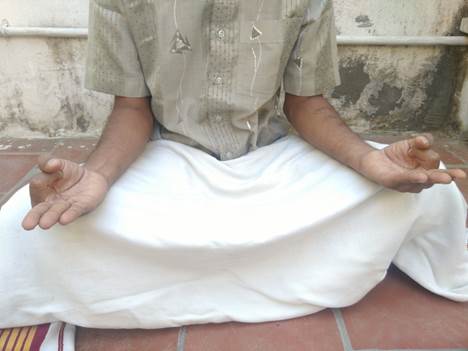
At what (x,y) coordinates should I click in order to perform the action: click on white sheet. Please return your answer as a coordinate pair (x, y). Looking at the image, I should click on (47, 261).